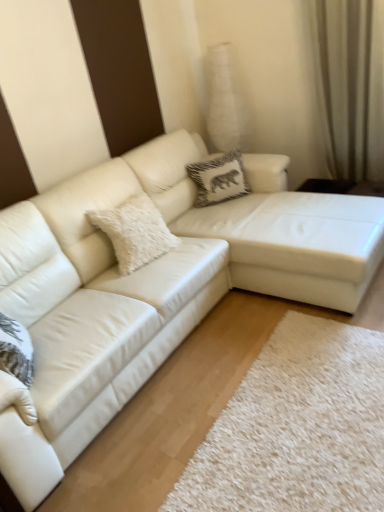
Question: Visually, is white leather couch at center positioned to the left or to the right of white fluffy pillow at center, placed as the first pillow when sorted from left to right?

Choices:
 (A) left
 (B) right

Answer: (B)

Question: Considering the positions of white leather couch at center and white fluffy pillow at center, which is the 1th pillow from bottom to top, in the image, is white leather couch at center taller or shorter than white fluffy pillow at center, which is the 1th pillow from bottom to top,?

Choices:
 (A) short
 (B) tall

Answer: (B)

Question: Which is nearer to the white fluffy pillow at center, which ranks as the second pillow in back-to-front order?

Choices:
 (A) beige fabric curtain at upper right
 (B) white textured pillow at center, arranged as the 2th pillow when viewed from the left
 (C) white leather couch at center

Answer: (C)

Question: Estimate the real-world distances between objects in this image. Which object is closer to the white fluffy pillow at center, which appears as the 2th pillow when viewed from the right?

Choices:
 (A) white textured pillow at center, arranged as the 2th pillow when viewed from the left
 (B) beige fabric curtain at upper right
 (C) white leather couch at center

Answer: (C)